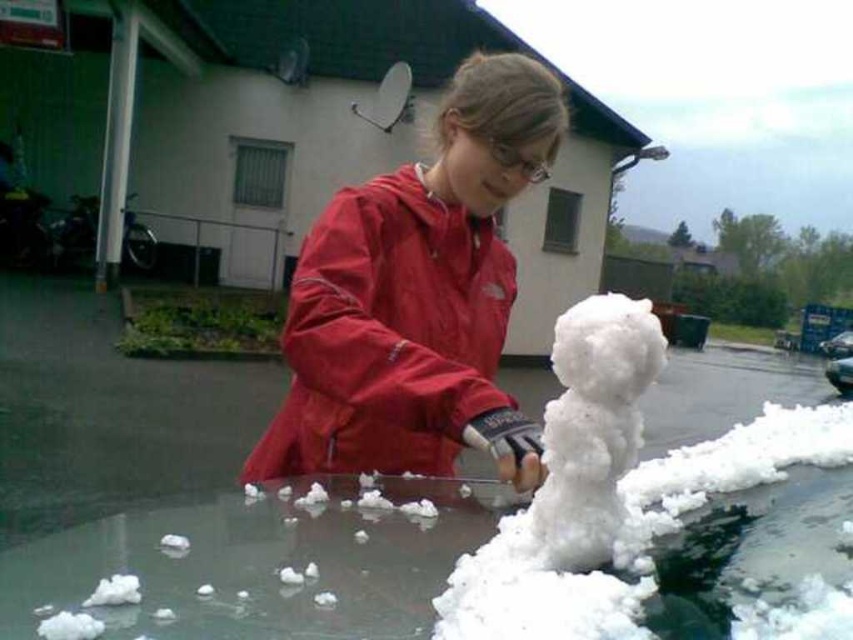
How distant is matte red jacket at center from white fluffy snowman at center?

matte red jacket at center is 10.50 inches from white fluffy snowman at center.

Does matte red jacket at center have a greater width compared to white fluffy snowman at center?

Yes.

Identify the location of matte red jacket at center. Image resolution: width=853 pixels, height=640 pixels. (416, 296).

This screenshot has width=853, height=640. I want to click on matte red jacket at center, so click(x=416, y=296).

Which is in front, point (437, 186) or point (838, 388)?

Positioned in front is point (437, 186).

The width and height of the screenshot is (853, 640). I want to click on matte red jacket at center, so click(416, 296).

Between point (593, 356) and point (842, 385), which one is positioned behind?

The point (842, 385) is more distant.

Is point (628, 333) positioned after point (834, 369)?

That is False.

You are a GUI agent. You are given a task and a screenshot of the screen. Output one action in this format:
    pyautogui.click(x=<x>, y=<y>)
    Task: Click on the white fluffy snowman at center
    This screenshot has height=640, width=853.
    Given the screenshot: What is the action you would take?
    pyautogui.click(x=593, y=426)